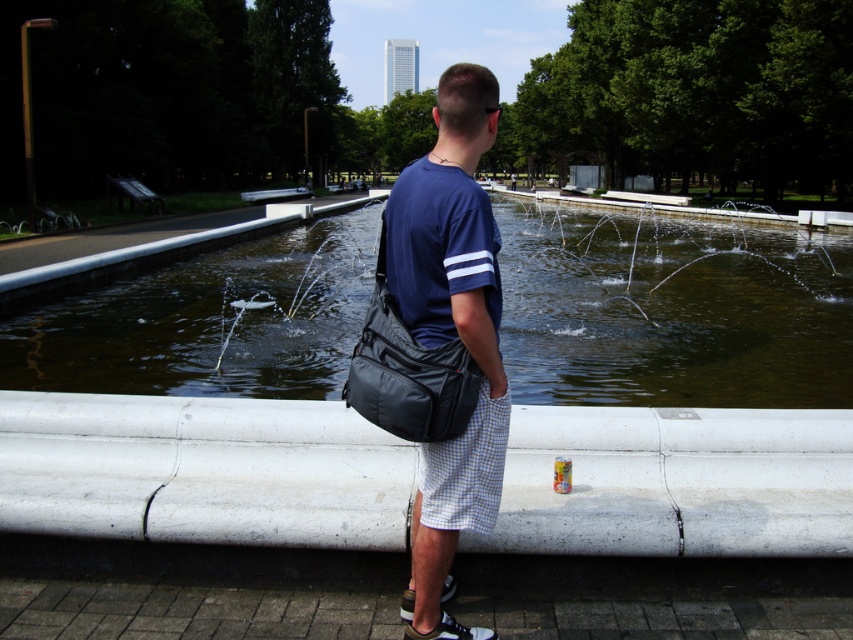
Question: Which of these objects is positioned farthest from the matte black bag at center?

Choices:
 (A) black fabric bag at center
 (B) clear water at center

Answer: (B)

Question: Which is nearer to the clear water at center?

Choices:
 (A) matte black bag at center
 (B) black fabric bag at center

Answer: (A)

Question: Which of the following is the farthest from the observer?

Choices:
 (A) (502, 417)
 (B) (308, 328)

Answer: (B)

Question: Where is clear water at center located in relation to matte black bag at center in the image?

Choices:
 (A) above
 (B) below

Answer: (A)

Question: Does clear water at center appear on the left side of matte black bag at center?

Choices:
 (A) yes
 (B) no

Answer: (B)

Question: Observing the image, what is the correct spatial positioning of clear water at center in reference to black fabric bag at center?

Choices:
 (A) below
 (B) above

Answer: (B)